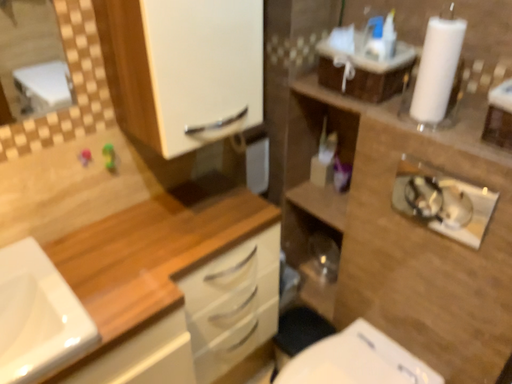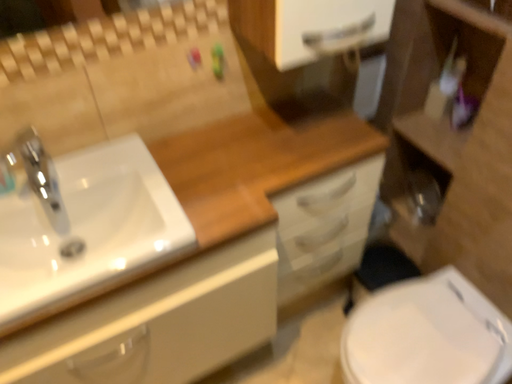
Question: How did the camera likely rotate when shooting the video?

Choices:
 (A) rotated upward
 (B) rotated downward

Answer: (B)